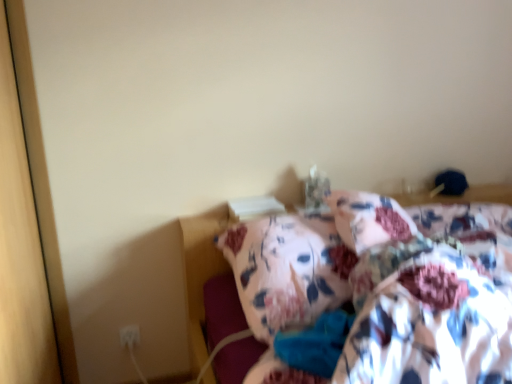
Question: From a real-world perspective, is white plastic electric outlet at lower left physically located above or below floral fabric blanket at center?

Choices:
 (A) above
 (B) below

Answer: (B)

Question: From their relative heights in the image, would you say white plastic electric outlet at lower left is taller or shorter than floral fabric blanket at center?

Choices:
 (A) tall
 (B) short

Answer: (B)

Question: Which is farther from the floral fabric bed at center?

Choices:
 (A) floral fabric blanket at center
 (B) white plastic electric outlet at lower left

Answer: (A)

Question: Which is nearer to the white plastic electric outlet at lower left?

Choices:
 (A) floral fabric blanket at center
 (B) floral fabric bed at center

Answer: (B)